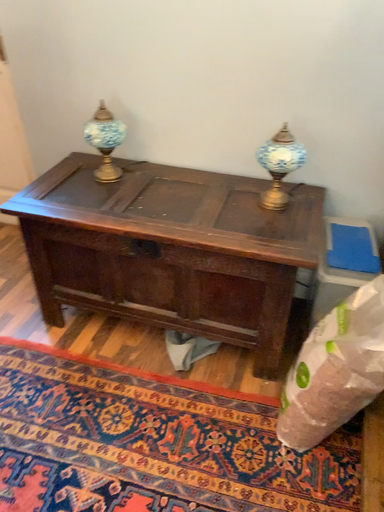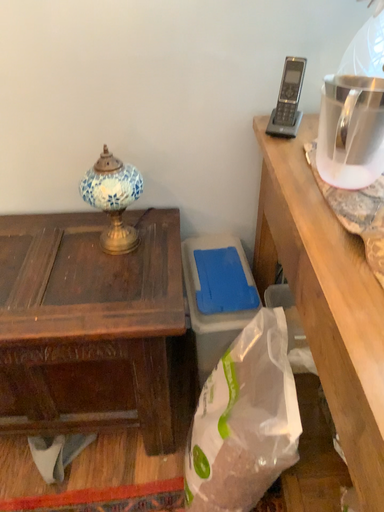
Question: How did the camera likely rotate when shooting the video?

Choices:
 (A) rotated right
 (B) rotated left

Answer: (A)